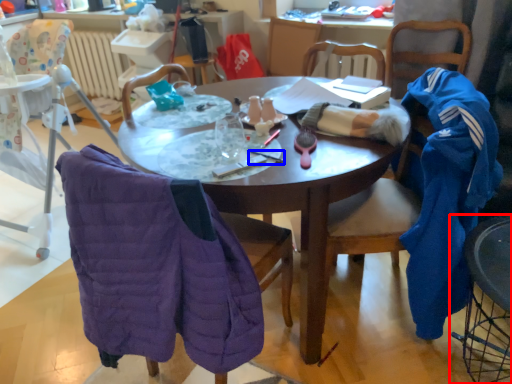
Question: Which of the following is the closest to the observer, chair (highlighted by a red box) or pen (highlighted by a blue box)?

Choices:
 (A) chair
 (B) pen

Answer: (A)